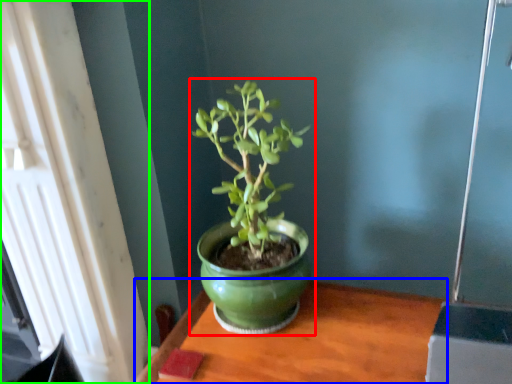
Question: Based on their relative distances, which object is farther from houseplant (highlighted by a red box)? Choose from table (highlighted by a blue box) and window (highlighted by a green box).

Choices:
 (A) table
 (B) window

Answer: (B)